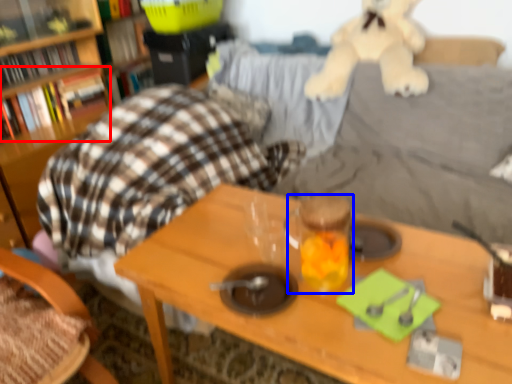
Question: Among these objects, which one is nearest to the camera, book (highlighted by a red box) or beverage (highlighted by a blue box)?

Choices:
 (A) book
 (B) beverage

Answer: (B)